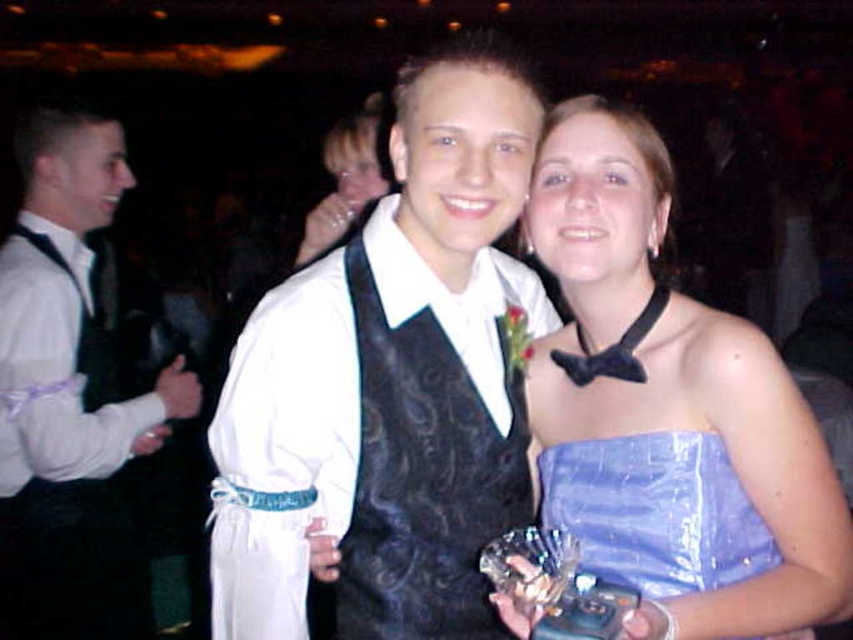
Is white satin vest at left further to the viewer compared to satin blue dress at center?

Yes.

Image resolution: width=853 pixels, height=640 pixels. Find the location of `white satin vest at left`. white satin vest at left is located at coordinates (70, 394).

Can you confirm if shiny blue fabric dress at center is bigger than black satin bow tie at upper center?

Yes, shiny blue fabric dress at center is bigger than black satin bow tie at upper center.

Is point (666, 492) farther from viewer compared to point (581, 374)?

No, (666, 492) is in front of (581, 374).

Where is `shiny blue fabric dress at center`? The width and height of the screenshot is (853, 640). shiny blue fabric dress at center is located at coordinates (654, 513).

Who is lower down, blue satin dress at center or black satin bow tie at upper center?

blue satin dress at center is below.

Describe the element at coordinates (671, 412) in the screenshot. The height and width of the screenshot is (640, 853). I see `blue satin dress at center` at that location.

Where is `blue satin dress at center`? The image size is (853, 640). blue satin dress at center is located at coordinates pos(671,412).

Image resolution: width=853 pixels, height=640 pixels. Identify the location of blue satin dress at center. (671, 412).